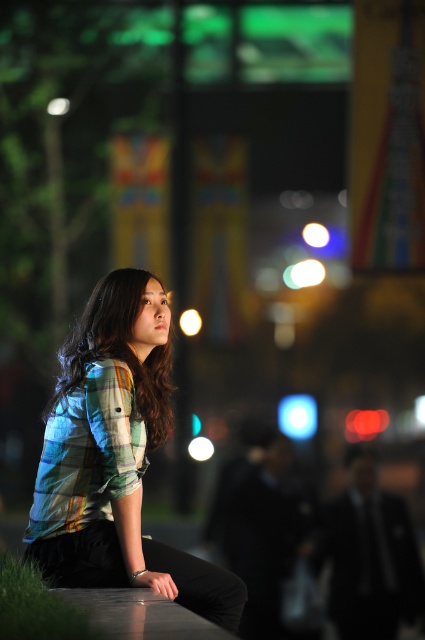
Question: Which object is farther from the camera taking this photo?

Choices:
 (A) plaid fabric shirt at center
 (B) plaid shirt at center

Answer: (B)

Question: Does plaid fabric shirt at center lie behind plaid shirt at center?

Choices:
 (A) no
 (B) yes

Answer: (A)

Question: Can you confirm if plaid fabric shirt at center is wider than plaid shirt at center?

Choices:
 (A) no
 (B) yes

Answer: (B)

Question: Can you confirm if plaid fabric shirt at center is positioned below plaid shirt at center?

Choices:
 (A) yes
 (B) no

Answer: (A)

Question: Which point is farther to the camera?

Choices:
 (A) (155, 428)
 (B) (136, 280)

Answer: (B)